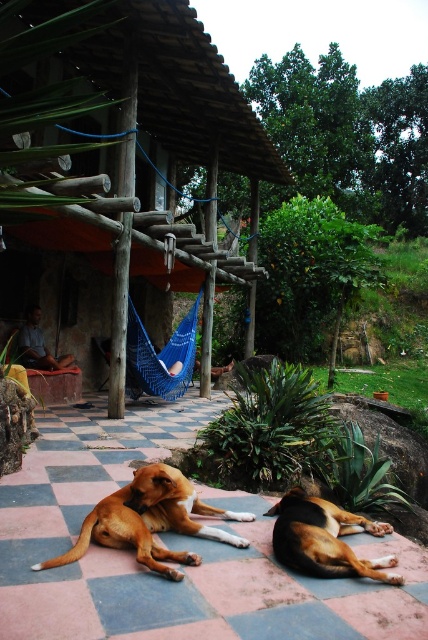
Between point (342, 529) and point (53, 356), which one is positioned in front?

Positioned in front is point (342, 529).

Describe the element at coordinates (324, 538) in the screenshot. I see `brown furry dog at lower center` at that location.

This screenshot has width=428, height=640. What do you see at coordinates (324, 538) in the screenshot?
I see `brown furry dog at lower center` at bounding box center [324, 538].

Image resolution: width=428 pixels, height=640 pixels. What are the coordinates of `brown furry dog at lower center` in the screenshot? It's located at (324, 538).

Consider the image. Between blue knitted hammock at center and wooden chair at center, which one appears on the right side from the viewer's perspective?

From the viewer's perspective, blue knitted hammock at center appears more on the right side.

Between point (136, 346) and point (20, 332), which one is positioned in front?

Positioned in front is point (136, 346).

In order to click on blue knitted hammock at center in this screenshot , I will do `click(160, 356)`.

Does brown fur dog at lower left appear over brown furry dog at lower center?

Yes, brown fur dog at lower left is above brown furry dog at lower center.

Can you confirm if brown fur dog at lower left is bigger than brown furry dog at lower center?

Yes.

Between point (142, 554) and point (348, 554), which one is positioned in front?

Positioned in front is point (142, 554).

Locate an element on the screen. Image resolution: width=428 pixels, height=640 pixels. brown fur dog at lower left is located at coordinates (151, 520).